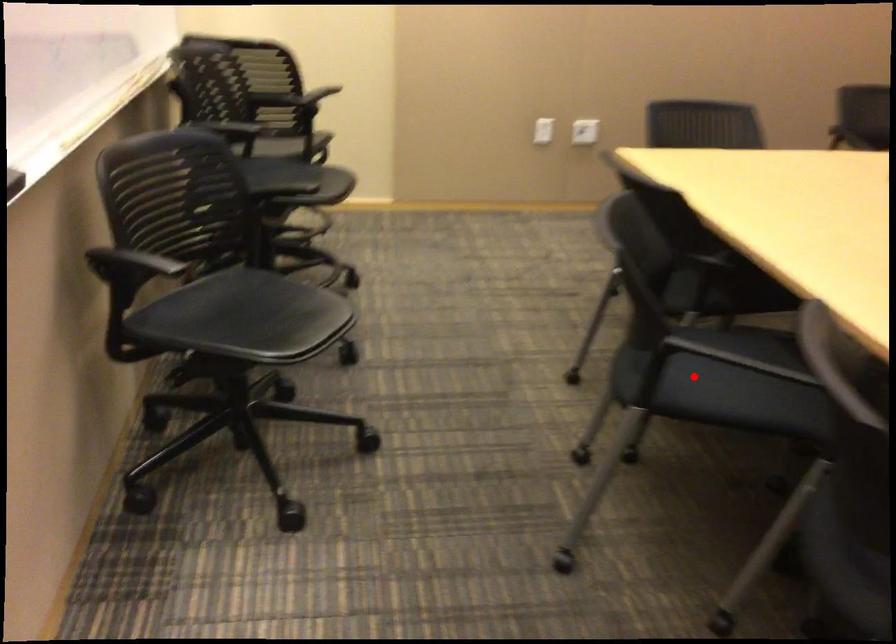
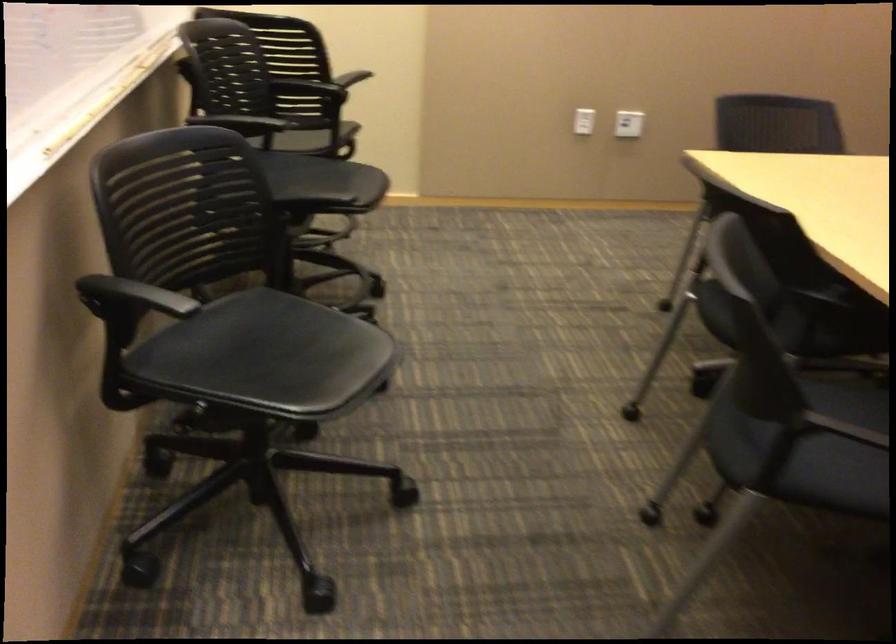
Find the pixel in the second image that matches the highlighted location in the first image.

(804, 442)